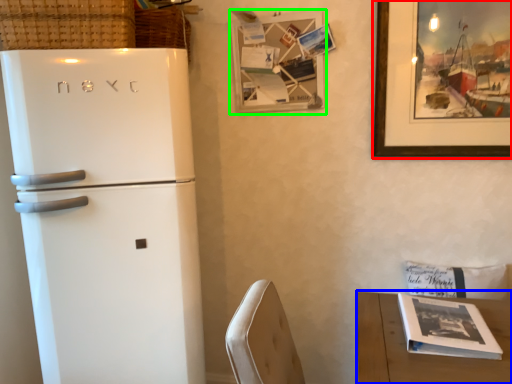
Question: Estimate the real-world distances between objects in this image. Which object is closer to picture frame (highlighted by a red box), table (highlighted by a blue box) or picture frame (highlighted by a green box)?

Choices:
 (A) table
 (B) picture frame

Answer: (B)